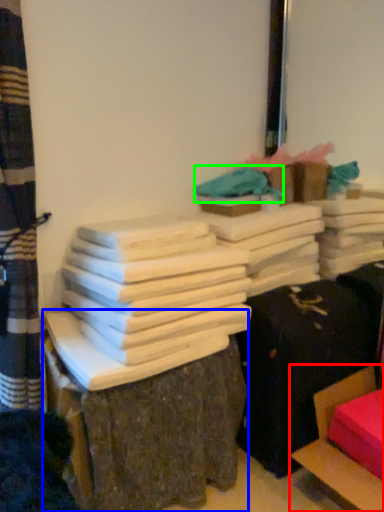
Question: Based on their relative distances, which object is nearer to furniture (highlighted by a red box)? Choose from furniture (highlighted by a blue box) and fabric (highlighted by a green box).

Choices:
 (A) furniture
 (B) fabric

Answer: (A)